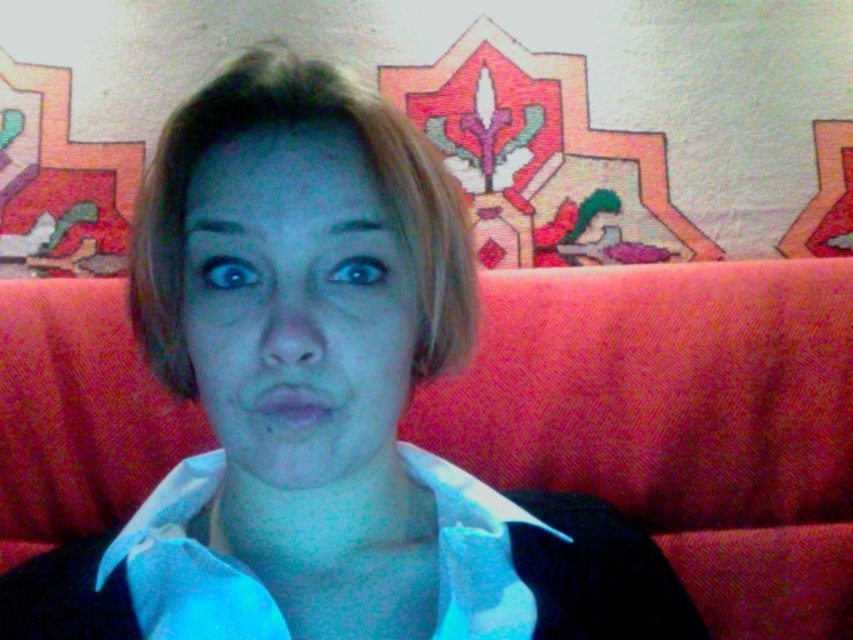
You are a photographer setting up a shoot in this scene. You need to position a spotlight to the left of the matte pink lips at center so it doesn not cast a shadow on the white cotton shirt at center. Can you do this?

The white cotton shirt at center is to the right of the matte pink lips at center. Positioning the spotlight to the left of the matte pink lips at center would cast light towards the right, illuminating the white cotton shirt at center without casting a shadow on it.

You are a makeup artist observing a client in a dimly lit room. The client is sitting on a red couch with a textured fabric. You need to apply lipstick. The client has a matte skin face at center and matte pink lips at center. Which part of the client has a wider width?

The matte skin face at center has a greater width than the matte pink lips at center.